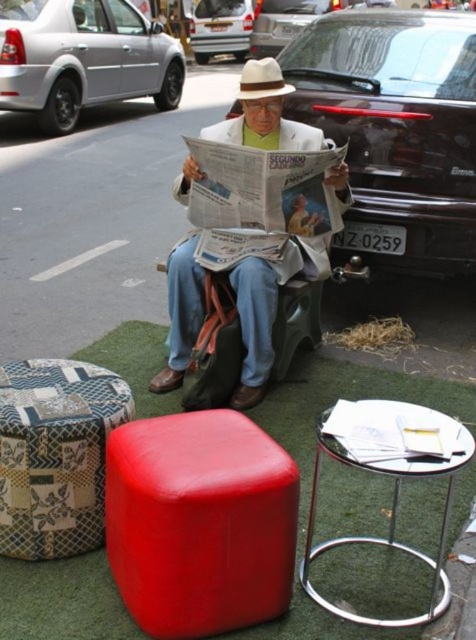
You are standing in the plaza and want to take a photo of the man reading the newspaper. You notice two points marked in the image. Which point is closer to you, point (291, 36) or point (271, 70)?

Point (291, 36) is closer to you than point (271, 70) because it is further to the viewer.

You are a photographer trying to capture a clear shot of the metallic silver car at upper center and the white felt cowboy hat at center. Since you want both objects to appear equally sized in the photo, which object should you move closer to?

To make the metallic silver car at upper center and the white felt cowboy hat at center appear the same size in the photo, you should move closer to the white felt cowboy hat at center because the metallic silver car at upper center is wider than the white felt cowboy hat at center. This way, the distance adjustment will balance their apparent sizes.